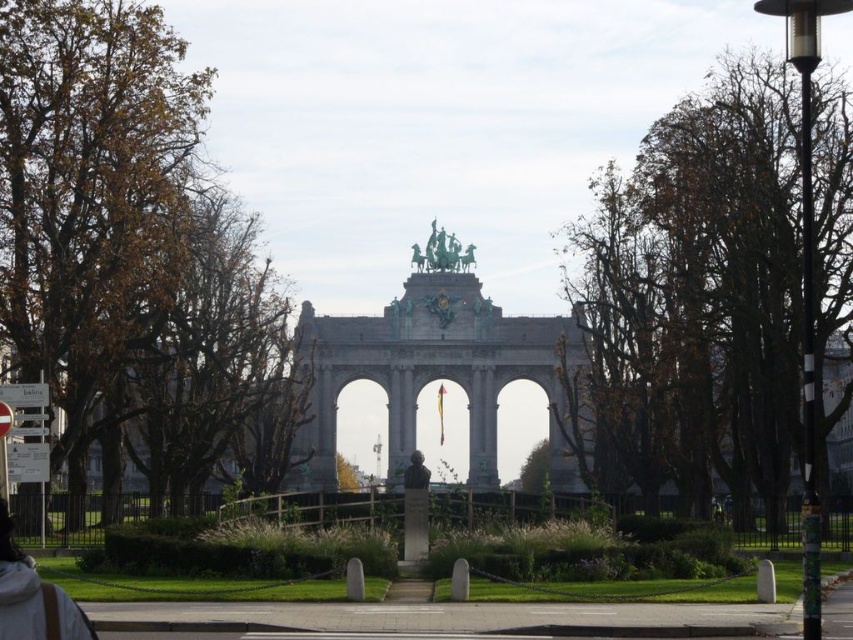
Question: Which point is farther from the camera taking this photo?

Choices:
 (A) (466, 253)
 (B) (409, 486)
 (C) (42, 620)
 (D) (86, 52)

Answer: (A)

Question: Among these objects, which one is nearest to the camera?

Choices:
 (A) bronze statue at center
 (B) brown leafy tree at left

Answer: (B)

Question: Can you confirm if brown leafy tree at left is thinner than bronze bust at center?

Choices:
 (A) yes
 (B) no

Answer: (B)

Question: Is brown leafy tree at right to the right of bronze bust at center from the viewer's perspective?

Choices:
 (A) no
 (B) yes

Answer: (B)

Question: Estimate the real-world distances between objects in this image. Which object is farther from the brown leafy tree at right?

Choices:
 (A) bronze statue at center
 (B) bronze bust at center

Answer: (B)

Question: In this image, where is bronze statue at center located relative to bronze bust at center?

Choices:
 (A) above
 (B) below

Answer: (A)